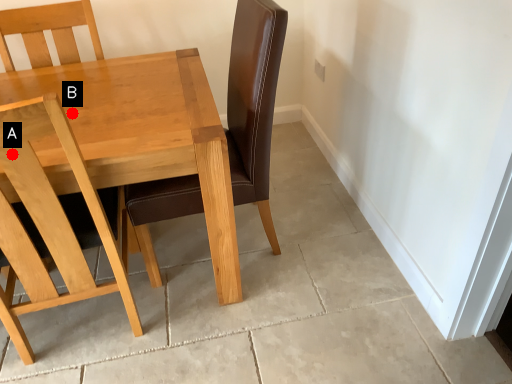
Question: Two points are circled on the image, labeled by A and B beside each circle. Which of the following is the farthest from the observer?

Choices:
 (A) A is further
 (B) B is further

Answer: (B)